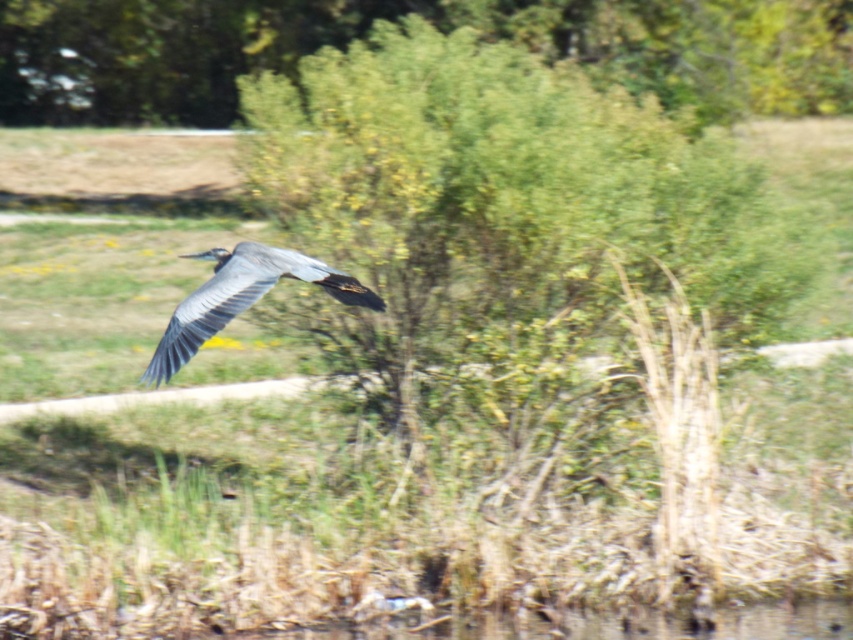
You are standing at the camera position and want to reach the point marked at coordinates point (131, 122). If you walk straight ahead, will you reach that point?

The point marked at coordinates point (131, 122) is 32.65 meters away from the camera position, so yes, walking straight ahead will lead you to that point since it is in the direction the camera is facing.

You are a photographer trying to capture the heron in flight. You notice a point at coordinates (433, 22) in your viewfinder. Based on the scene, what object is this point located on?

The point at coordinates (433, 22) is located on the green leafy tree at upper center.

You are a photographer aiming to capture the gray matte bird at center without the green leafy tree at upper center blocking it. What adjustment should you make to the camera angle?

To avoid the green leafy tree at upper center blocking the gray matte bird at center, you should lower the camera angle so that the bird is framed below the tree.